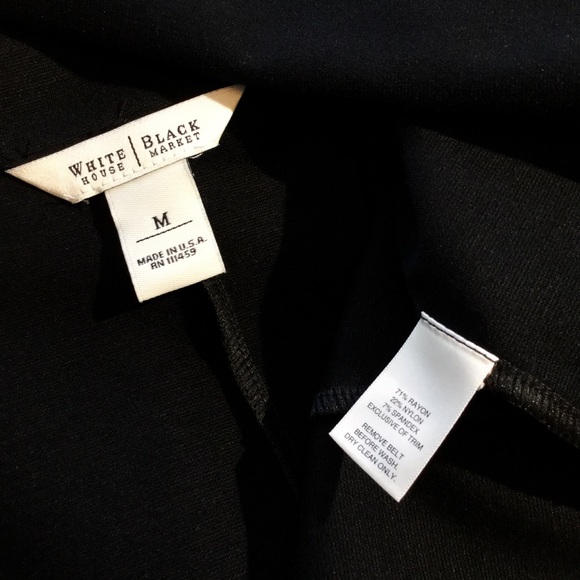
Find the location of a particular element. fabric seam is located at coordinates (224, 321), (258, 398), (328, 401), (516, 393), (564, 416).